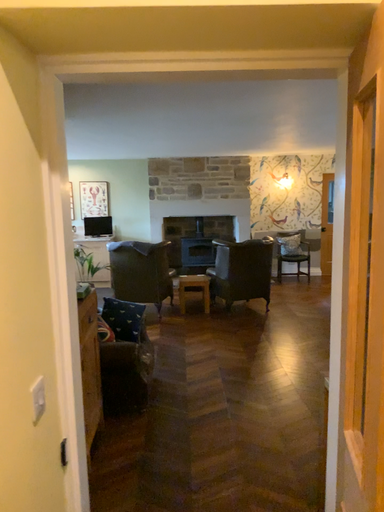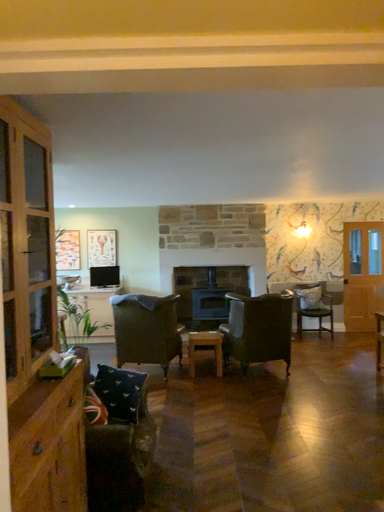
Question: Which way did the camera rotate in the video?

Choices:
 (A) rotated downward
 (B) rotated upward

Answer: (B)